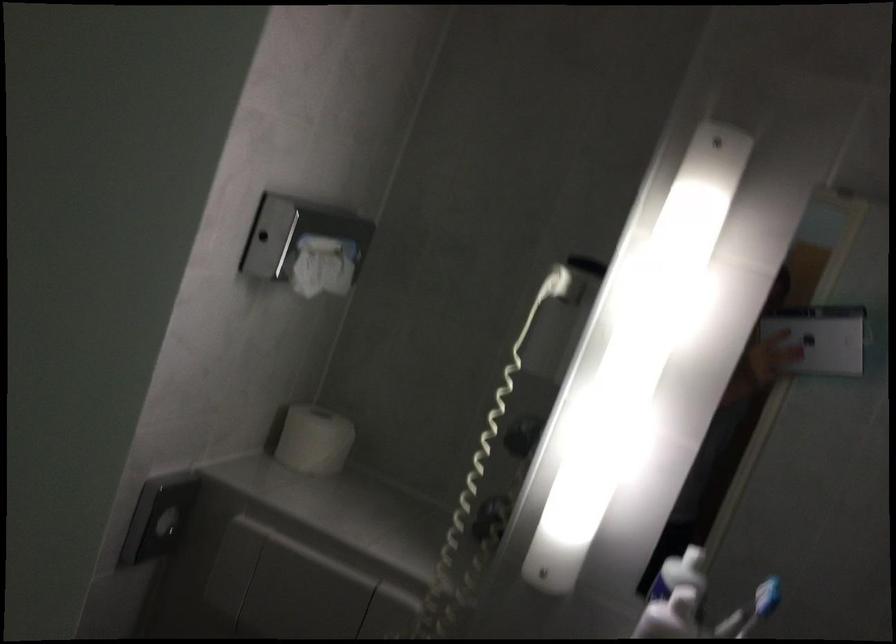
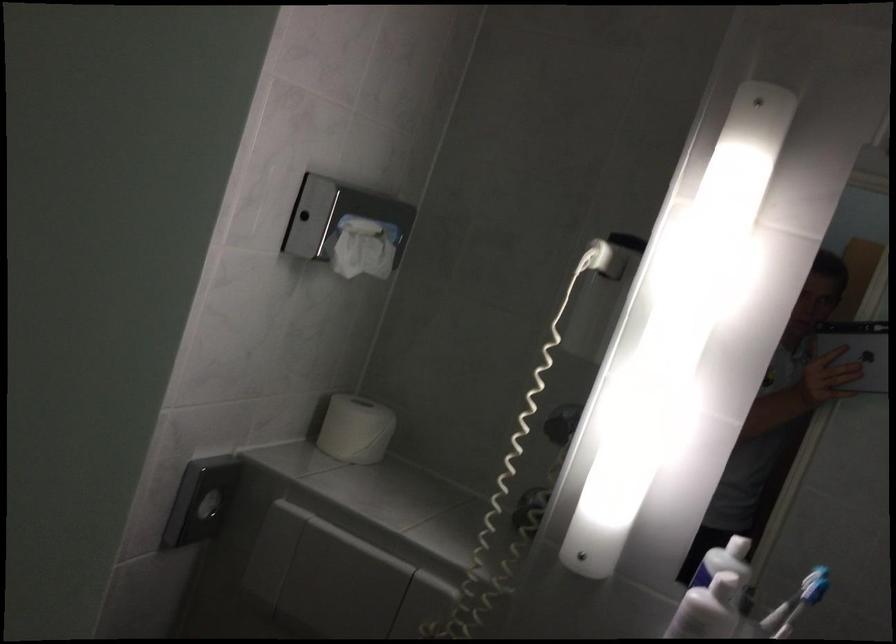
In the second image, find the point that corresponds to pixel 324 263 in the first image.

(364, 247)